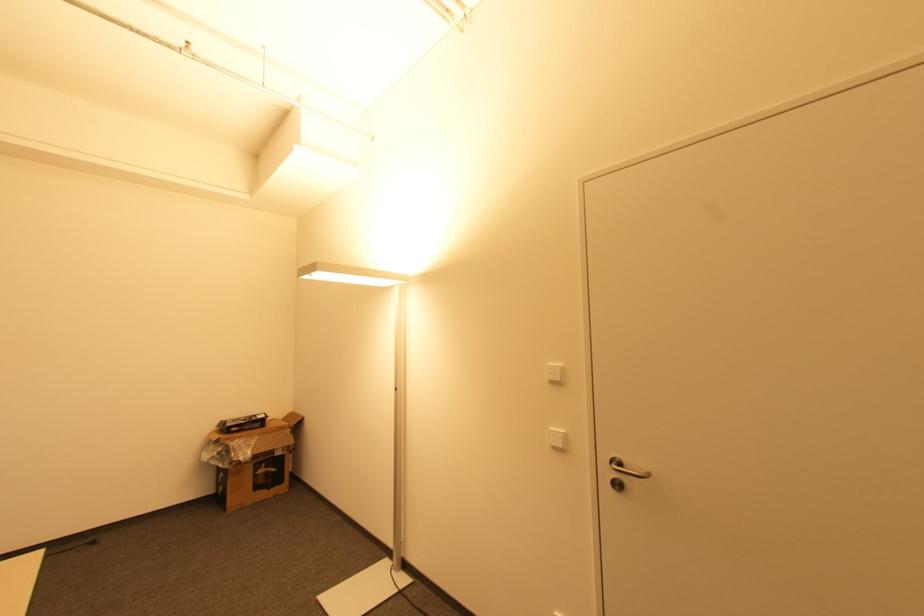
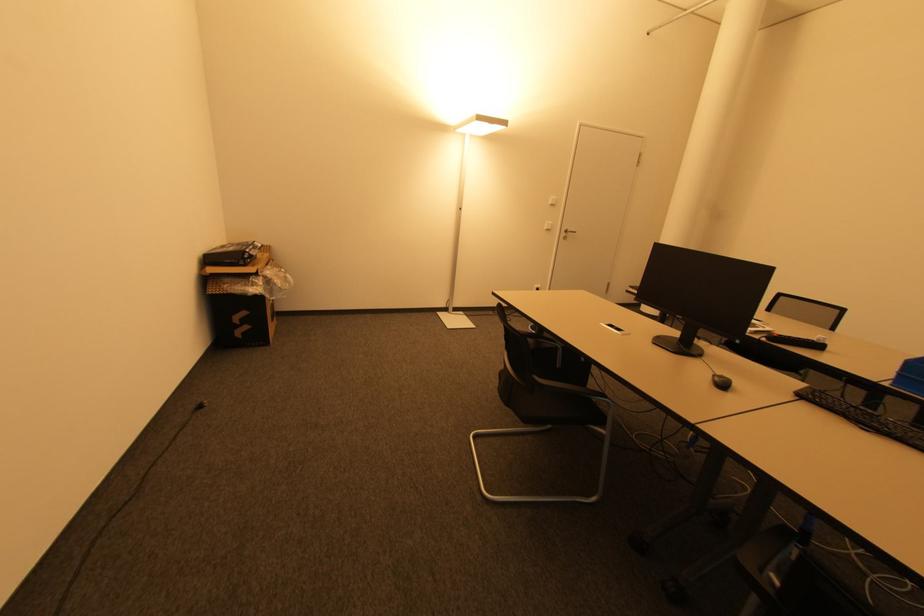
Locate, in the second image, the point that corresponds to (237,430) in the first image.

(250, 261)